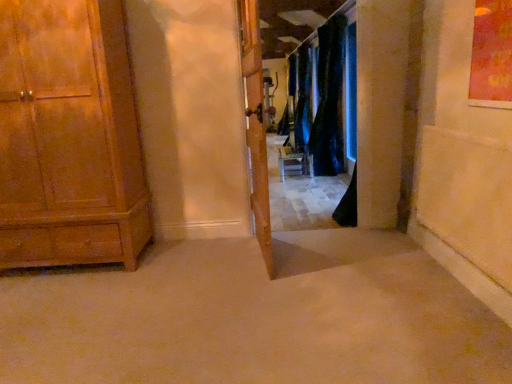
Question: Can you confirm if wooden door at center is shorter than dark blue velvet curtains at center, arranged as the 1th curtain when viewed from the back?

Choices:
 (A) yes
 (B) no

Answer: (A)

Question: From a real-world perspective, does wooden door at center stand above dark blue velvet curtains at center, arranged as the 1th curtain when viewed from the back?

Choices:
 (A) no
 (B) yes

Answer: (A)

Question: From a real-world perspective, is wooden door at center positioned under dark blue velvet curtains at center, arranged as the 2th curtain when viewed from the front, based on gravity?

Choices:
 (A) no
 (B) yes

Answer: (B)

Question: Considering the relative positions of wooden door at center and dark blue velvet curtains at center, arranged as the 2th curtain when viewed from the front, in the image provided, is wooden door at center behind dark blue velvet curtains at center, arranged as the 2th curtain when viewed from the front,?

Choices:
 (A) yes
 (B) no

Answer: (B)

Question: Considering the relative sizes of wooden door at center and dark blue velvet curtains at center, arranged as the 1th curtain when viewed from the back, in the image provided, is wooden door at center smaller than dark blue velvet curtains at center, arranged as the 1th curtain when viewed from the back,?

Choices:
 (A) no
 (B) yes

Answer: (B)

Question: Do you think wooden door at center is within dark blue velvet curtains at center, arranged as the 1th curtain when viewed from the back, or outside of it?

Choices:
 (A) outside
 (B) inside

Answer: (A)

Question: Is wooden door at center in front of or behind dark blue velvet curtains at center, arranged as the 2th curtain when viewed from the front, in the image?

Choices:
 (A) behind
 (B) front

Answer: (B)

Question: Considering the positions of point (245, 91) and point (301, 61), is point (245, 91) closer or farther from the camera than point (301, 61)?

Choices:
 (A) closer
 (B) farther

Answer: (A)

Question: From the image's perspective, is wooden door at center above or below dark blue velvet curtains at center, arranged as the 1th curtain when viewed from the back?

Choices:
 (A) below
 (B) above

Answer: (A)

Question: Considering the positions of wooden cabinet at left and black velvet curtain at center, which is counted as the 1th curtain, starting from the front, in the image, is wooden cabinet at left wider or thinner than black velvet curtain at center, which is counted as the 1th curtain, starting from the front,?

Choices:
 (A) wide
 (B) thin

Answer: (A)

Question: Is point (18, 46) closer or farther from the camera than point (326, 84)?

Choices:
 (A) farther
 (B) closer

Answer: (B)

Question: From the image's perspective, is wooden cabinet at left above or below black velvet curtain at center, which is counted as the 1th curtain, starting from the front?

Choices:
 (A) below
 (B) above

Answer: (A)

Question: Which is correct: wooden cabinet at left is inside black velvet curtain at center, which is counted as the 1th curtain, starting from the front, or outside of it?

Choices:
 (A) outside
 (B) inside

Answer: (A)

Question: Is wooden cabinet at left spatially inside wooden door at center, or outside of it?

Choices:
 (A) outside
 (B) inside

Answer: (A)

Question: From the image's perspective, is wooden cabinet at left above or below wooden door at center?

Choices:
 (A) above
 (B) below

Answer: (B)